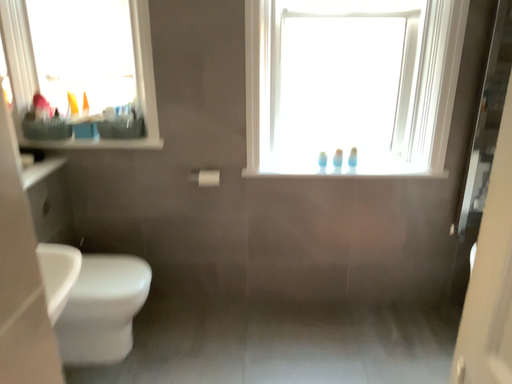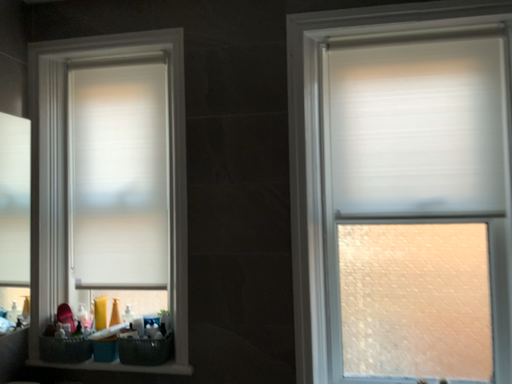
Question: Which way did the camera rotate in the video?

Choices:
 (A) rotated downward
 (B) rotated upward

Answer: (B)